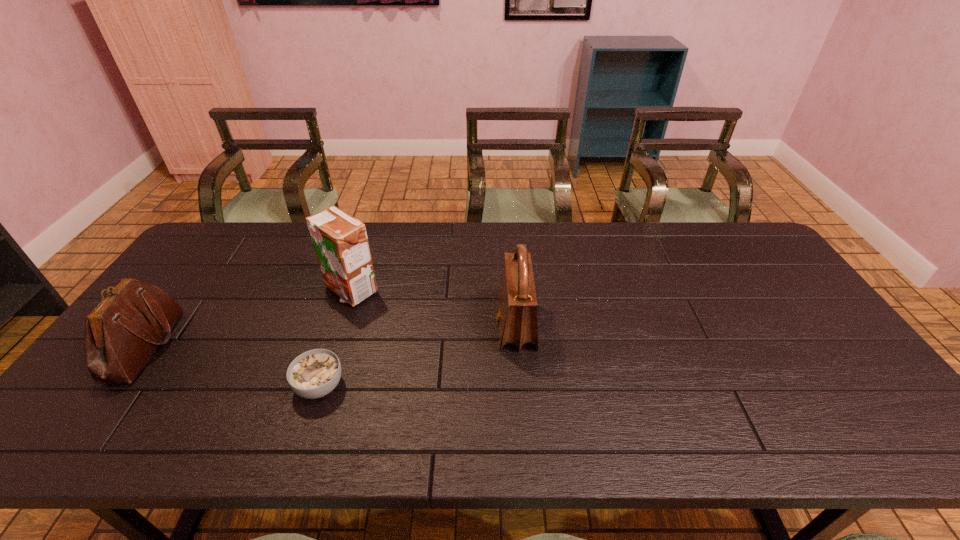
Find the location of a particular element. free space located 0.090m on the right of the third tallest object is located at coordinates (205, 346).

Locate an element on the screen. vacant space located on the left of the soup bowl is located at coordinates (212, 386).

Where is `object that is at the left edge`? This screenshot has width=960, height=540. object that is at the left edge is located at coordinates [122, 332].

Locate an element on the screen. vacant space at the far edge of the desktop is located at coordinates (643, 231).

The height and width of the screenshot is (540, 960). I want to click on free space at the near edge of the desktop, so click(622, 415).

In order to click on vacant space at the left edge of the desktop in this screenshot , I will do `click(166, 347)`.

In the image, there is a desktop. Identify the location of blank space at the far right corner. (716, 245).

Where is `free point between the shortest object and the right shoulder bag`? This screenshot has width=960, height=540. free point between the shortest object and the right shoulder bag is located at coordinates (418, 356).

Locate an element on the screen. The height and width of the screenshot is (540, 960). free space between the taller shoulder bag and the soup bowl is located at coordinates (418, 356).

Image resolution: width=960 pixels, height=540 pixels. I want to click on free space between the soup bowl and the right shoulder bag, so click(418, 356).